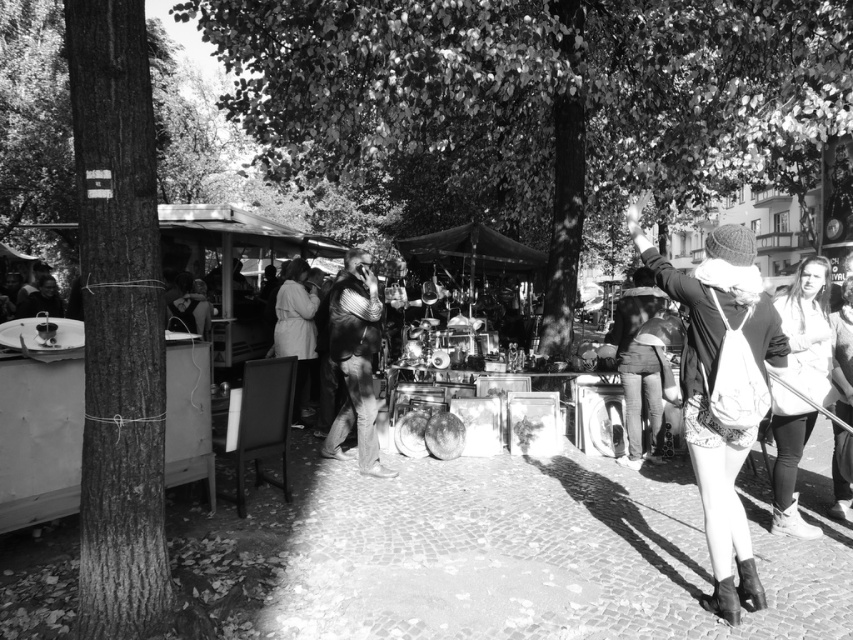
You are a customer at the flea market and want to buy a coat that is smaller in size. Which item between the leather jacket at center and the light beige fabric coat at center should you choose?

The light beige fabric coat at center is smaller in size compared to the leather jacket at center, so you should choose the light beige fabric coat at center.

You are a vendor at the flea market and need to decide which item to place first on your display table. You have a leather jacket at center and a light beige fabric coat at center. Which item requires more space on the table due to its width?

The leather jacket at center requires more space on the table because its width is larger than the light beige fabric coat at center.